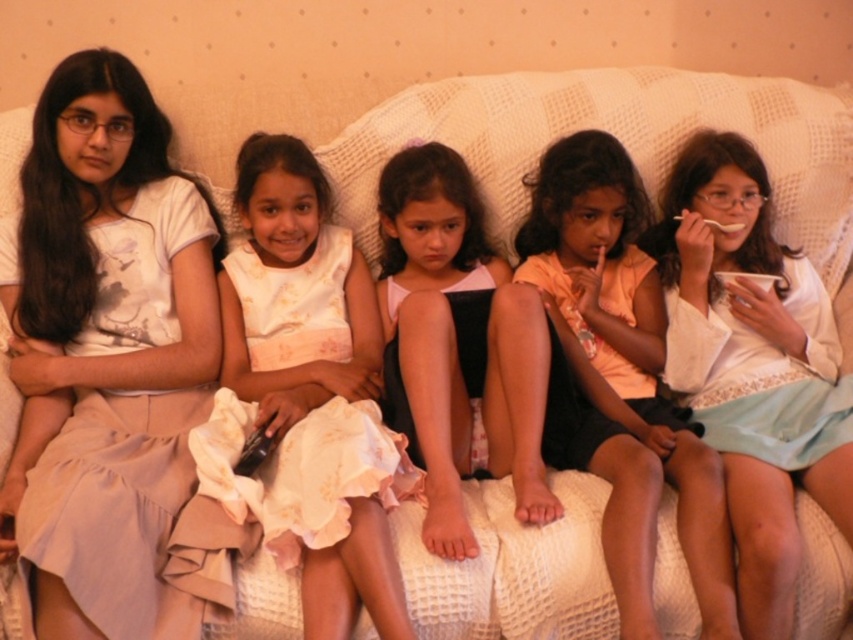
Between white cotton dress at left and light pink satin dress at center, which one is positioned higher?

Positioned higher is white cotton dress at left.

Can you confirm if white cotton dress at left is positioned to the left of light pink satin dress at center?

Yes, white cotton dress at left is to the left of light pink satin dress at center.

Locate an element on the screen. The width and height of the screenshot is (853, 640). white cotton dress at left is located at coordinates (106, 340).

Is white cotton dress at left positioned at the back of light pink fabric dress at center?

No, white cotton dress at left is closer to the viewer.

Between point (88, 234) and point (653, 480), which one is positioned behind?

Point (88, 234)

You are a GUI agent. You are given a task and a screenshot of the screen. Output one action in this format:
    pyautogui.click(x=<x>, y=<y>)
    Task: Click on the white cotton dress at left
    The image size is (853, 640).
    Given the screenshot: What is the action you would take?
    pyautogui.click(x=106, y=340)

Is white cotton dress at center taller than matte black dress at center?

Yes.

The height and width of the screenshot is (640, 853). What are the coordinates of `white cotton dress at center` in the screenshot? It's located at (753, 365).